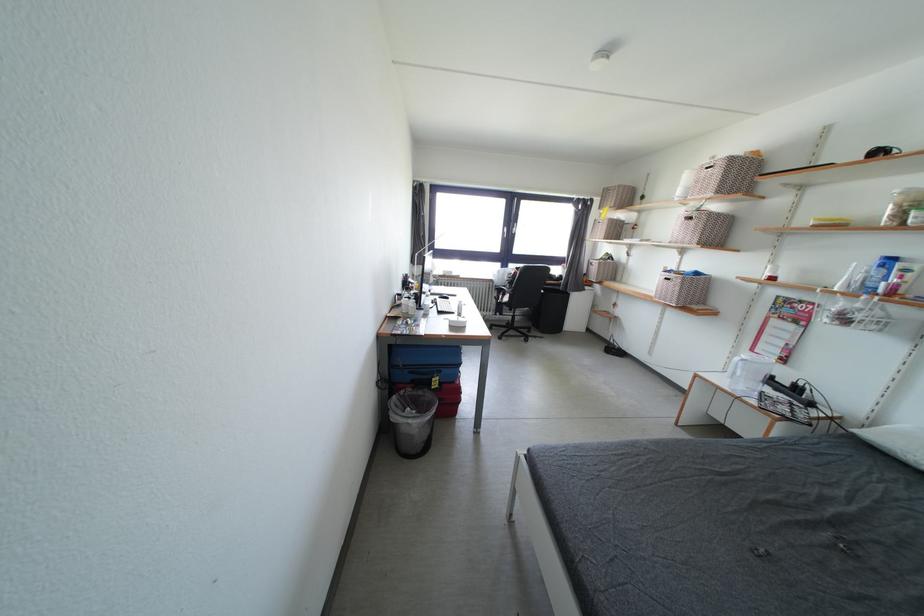
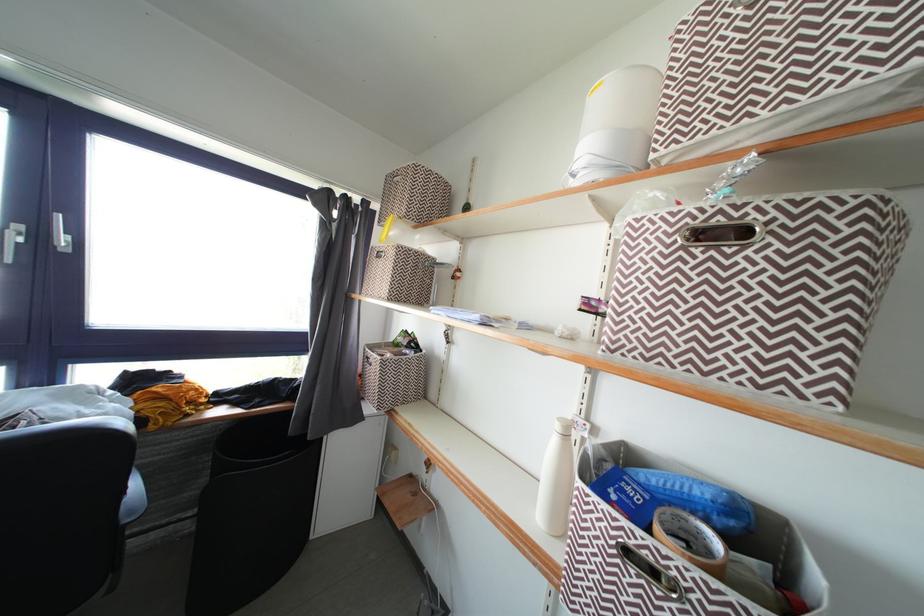
In the second image, find the point that corresponds to (x=675, y=280) in the first image.

(643, 541)